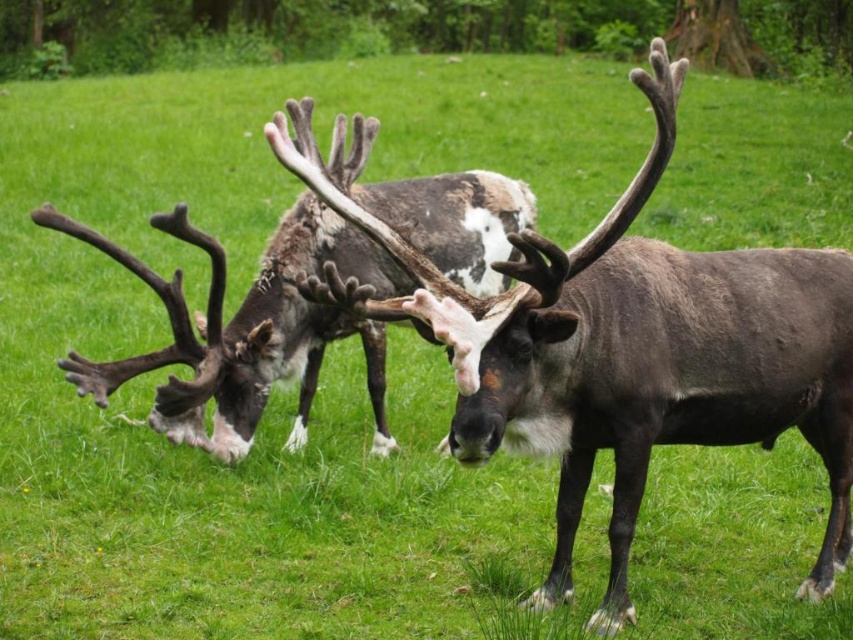
You are standing in the field and want to take a photo of the point at coordinates point (357, 294). If your camera has a maximum focus range of 10 feet, will it be able to focus on that point?

The distance of point (357, 294) from camera is 11.03 feet, which is beyond the camera maximum focus range of 10 feet. So the camera cannot focus on that point.

In the serene green field scene with a backdrop of dense trees, you notice two reindeer at the center. One has dark brown fur antlers, and the other has a speckled fur pattern. From the perspective of someone standing in front of the speckled fur reindeer at center, which direction would the dark brown fur antlers at center be located?

The dark brown fur antlers at center are to the right of the speckled fur reindeer at center, so from the perspective of someone standing in front of the speckled fur reindeer at center, the dark brown fur antlers at center would be located to the right side.

You are a wildlife photographer trying to capture a closeup shot of the dark brown fur antlers at center and the speckled fur reindeer at center. Based on their sizes, which one should you zoom in on more to ensure both are in focus?

The dark brown fur antlers at center is taller than the speckled fur reindeer at center, so you should zoom in more on the dark brown fur antlers at center to ensure both are in focus.